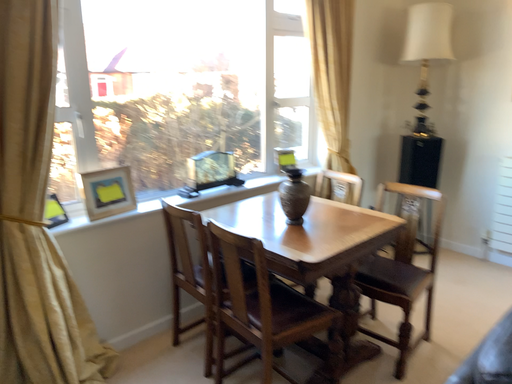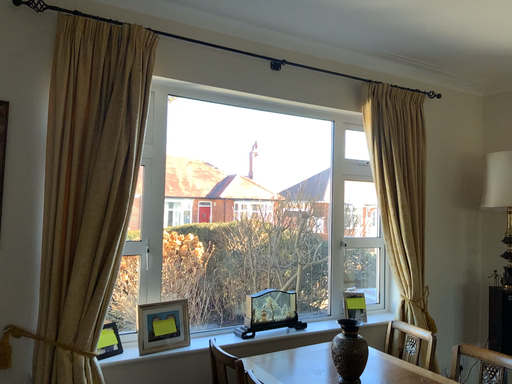
Question: Which way did the camera rotate in the video?

Choices:
 (A) rotated downward
 (B) rotated upward

Answer: (B)